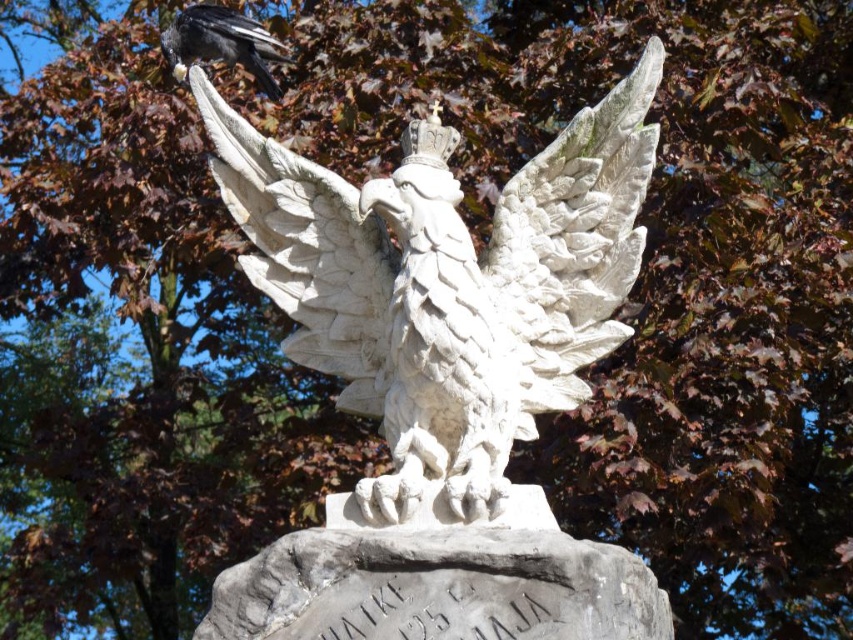
Question: Can you confirm if white stone eagle at center is positioned above shiny black raven at upper left?

Choices:
 (A) yes
 (B) no

Answer: (B)

Question: Which point appears farthest from the camera in this image?

Choices:
 (A) (242, 220)
 (B) (276, 81)

Answer: (B)

Question: Among these objects, which one is farthest from the camera?

Choices:
 (A) shiny black raven at upper left
 (B) white stone eagle at center

Answer: (A)

Question: Does white stone eagle at center lie behind shiny black raven at upper left?

Choices:
 (A) yes
 (B) no

Answer: (B)

Question: Is white stone eagle at center to the right of shiny black raven at upper left from the viewer's perspective?

Choices:
 (A) no
 (B) yes

Answer: (B)